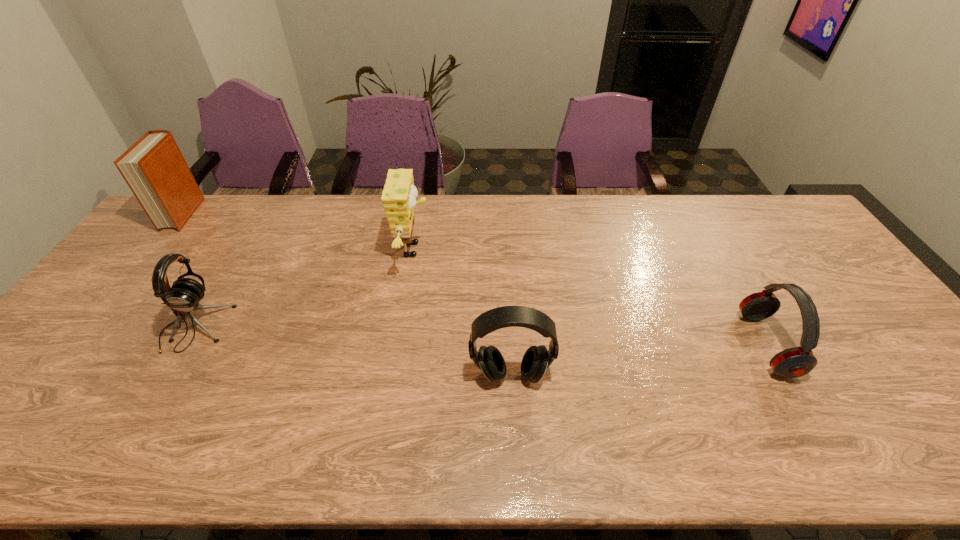
You are a GUI agent. You are given a task and a screenshot of the screen. Output one action in this format:
    pyautogui.click(x=<x>, y=<y>)
    Task: Click on the free space located on the ear cups of the shortest earphone
    This screenshot has width=960, height=540.
    Given the screenshot: What is the action you would take?
    pyautogui.click(x=633, y=345)

Identify the location of free point located 0.050m on the ear cups of the shortest earphone. (730, 345).

Where is `free space located 0.100m on the ear cups of the shortest earphone`? free space located 0.100m on the ear cups of the shortest earphone is located at coordinates (710, 345).

Locate an element on the screen. The width and height of the screenshot is (960, 540). hardback book situated at the far edge is located at coordinates (154, 168).

The height and width of the screenshot is (540, 960). What are the coordinates of `sponge that is at the far edge` in the screenshot? It's located at (399, 195).

The height and width of the screenshot is (540, 960). I want to click on object that is at the left edge, so click(x=154, y=168).

Where is `object that is positioned at the far left corner`? The width and height of the screenshot is (960, 540). object that is positioned at the far left corner is located at coordinates (154, 168).

The height and width of the screenshot is (540, 960). What are the coordinates of `free spot at the far edge of the desktop` in the screenshot? It's located at (237, 213).

Image resolution: width=960 pixels, height=540 pixels. Find the location of `free space at the near edge of the desktop`. free space at the near edge of the desktop is located at coordinates [x=262, y=461].

Where is `vacant space at the left edge of the desktop`? The width and height of the screenshot is (960, 540). vacant space at the left edge of the desktop is located at coordinates (27, 408).